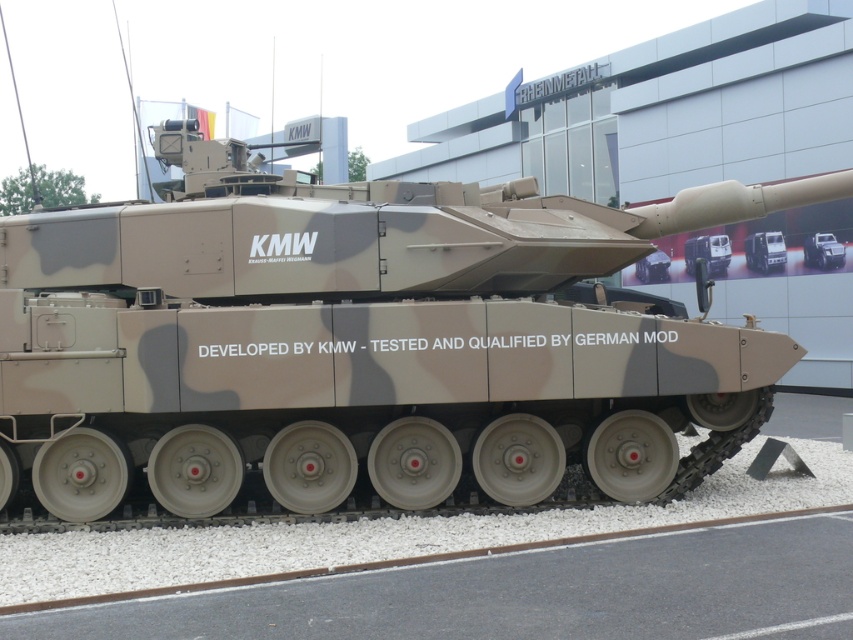
You are standing at the front of the tank and want to move towards the back. Which point, point (758, 268) or point (822, 244), would you reach first?

Point (822, 244) is in front of point (758, 268), so you would reach point (822, 244) first when moving from the front of the tank towards the back.

You are a military engineer tasked with positioning a new equipment crate that must be placed exactly 1 meter to the north of the camouflage matte tank at center. Given the tank is at coordinates point 0.394, 0.898, where should you place the crate?

The camouflage matte tank at center is located at point (x=764, y=252). To place the equipment crate 1 meter north, you would need to calculate the new coordinates based on the coordinate system used in the image. However, without knowing the scale or orientation of the coordinate system, an exact coordinate cannot be determined. Please provide additional information about the coordinate system to proceed.